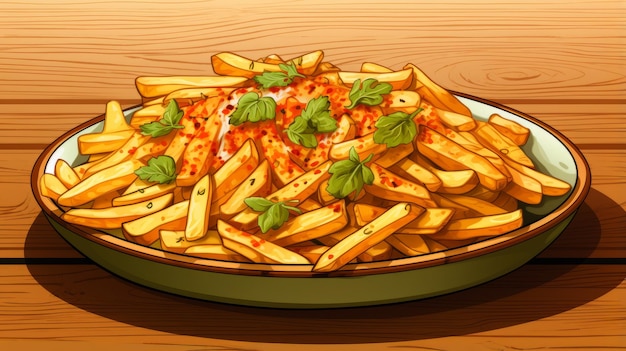
This screenshot has height=351, width=626. What are the coordinates of `gaps between boards` in the screenshot? It's located at (595, 263), (612, 148).